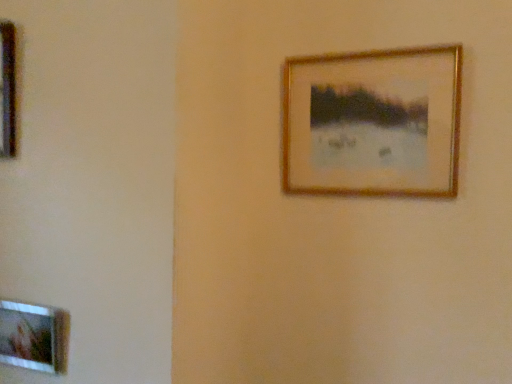
Question: Is wooden picture frame at lower left, arranged as the third picture frame when viewed from the top, positioned before gold metallic picture frame at upper right, placed as the 2th picture frame when sorted from top to bottom?

Choices:
 (A) yes
 (B) no

Answer: (A)

Question: From a real-world perspective, is wooden picture frame at lower left, which ranks as the 2th picture frame in right-to-left order, located beneath gold metallic picture frame at upper right, which is the 3th picture frame in left-to-right order?

Choices:
 (A) no
 (B) yes

Answer: (B)

Question: Does wooden picture frame at lower left, acting as the 1th picture frame starting from the bottom, have a greater height compared to gold metallic picture frame at upper right, placed as the 2th picture frame when sorted from top to bottom?

Choices:
 (A) no
 (B) yes

Answer: (A)

Question: From a real-world perspective, is wooden picture frame at lower left, marked as the second picture frame in a left-to-right arrangement, over gold metallic picture frame at upper right, which appears as the 2th picture frame when ordered from the bottom?

Choices:
 (A) yes
 (B) no

Answer: (B)

Question: Is wooden picture frame at lower left, which ranks as the 2th picture frame in right-to-left order, positioned far away from gold metallic picture frame at upper right, which appears as the 2th picture frame when ordered from the bottom?

Choices:
 (A) no
 (B) yes

Answer: (A)

Question: Would you say wooden picture frame at lower left, acting as the 1th picture frame starting from the bottom, is outside gold metallic picture frame at upper right, placed as the 2th picture frame when sorted from top to bottom?

Choices:
 (A) yes
 (B) no

Answer: (A)

Question: Does wooden picture frame at lower left, arranged as the third picture frame when viewed from the top, lie in front of metallic gold picture frame at left, which is the first picture frame in left-to-right order?

Choices:
 (A) yes
 (B) no

Answer: (B)

Question: Is wooden picture frame at lower left, arranged as the third picture frame when viewed from the top, beside metallic gold picture frame at left, which appears as the 3th picture frame when ordered from the bottom?

Choices:
 (A) yes
 (B) no

Answer: (B)

Question: Is the position of wooden picture frame at lower left, arranged as the third picture frame when viewed from the top, more distant than that of metallic gold picture frame at left, arranged as the first picture frame when viewed from the top?

Choices:
 (A) no
 (B) yes

Answer: (B)

Question: From the image's perspective, is wooden picture frame at lower left, marked as the second picture frame in a left-to-right arrangement, on metallic gold picture frame at left, which is the first picture frame in left-to-right order?

Choices:
 (A) yes
 (B) no

Answer: (B)

Question: Is wooden picture frame at lower left, which ranks as the 2th picture frame in right-to-left order, not near metallic gold picture frame at left, which is the first picture frame in left-to-right order?

Choices:
 (A) no
 (B) yes

Answer: (A)

Question: Is metallic gold picture frame at left, which is the first picture frame in left-to-right order, surrounded by wooden picture frame at lower left, arranged as the third picture frame when viewed from the top?

Choices:
 (A) yes
 (B) no

Answer: (B)

Question: Does metallic gold picture frame at left, which appears as the 3th picture frame when ordered from the bottom, come behind gold metallic picture frame at upper right, which appears as the 2th picture frame when ordered from the bottom?

Choices:
 (A) no
 (B) yes

Answer: (A)